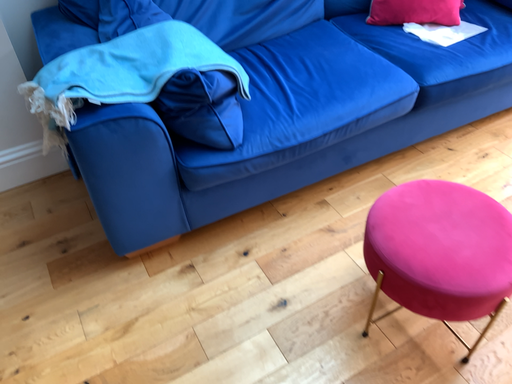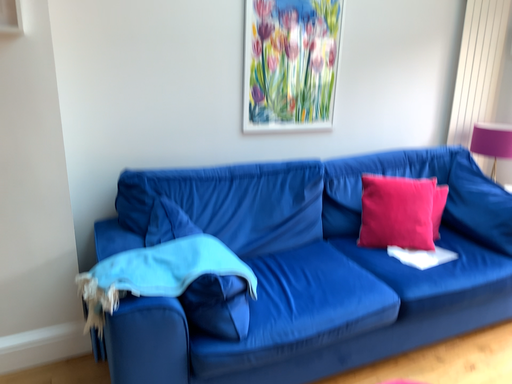
Question: Which way did the camera rotate in the video?

Choices:
 (A) rotated upward
 (B) rotated downward

Answer: (A)